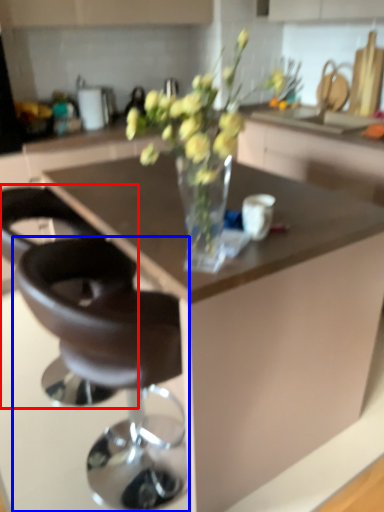
Question: Which of the following is the farthest to the observer, chair (highlighted by a red box) or chair (highlighted by a blue box)?

Choices:
 (A) chair
 (B) chair

Answer: (A)